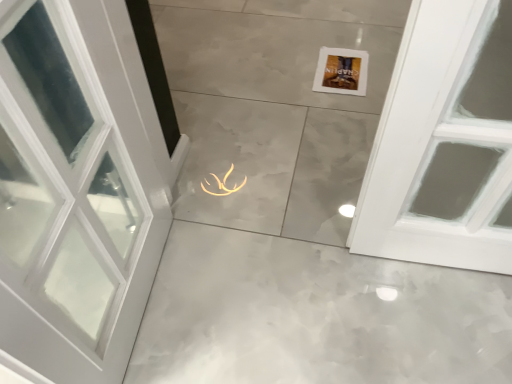
Image resolution: width=512 pixels, height=384 pixels. Identify the location of free space below matte gold postcard at upper right (from a real-world perspective). (340, 72).